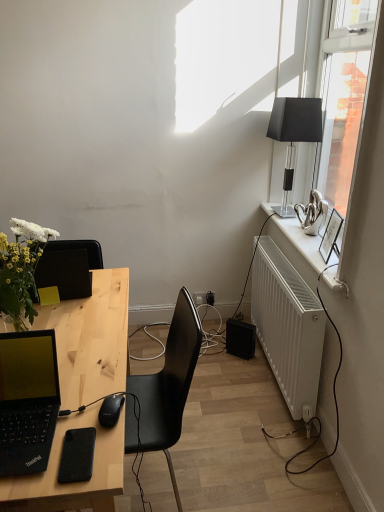
Locate an element on the screen. This screenshot has width=384, height=512. free area in between black plastic speaker at lower right and white matte radiator at right is located at coordinates (261, 379).